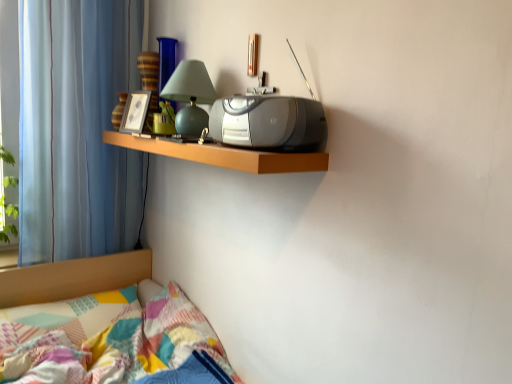
Question: In terms of size, does wooden shelf at upper center appear bigger or smaller than blue striped curtain at left?

Choices:
 (A) big
 (B) small

Answer: (B)

Question: Relative to blue striped curtain at left, is wooden shelf at upper center in front or behind?

Choices:
 (A) front
 (B) behind

Answer: (A)

Question: Based on their relative distances, which object is farther from the matte green glass table lamp at upper center?

Choices:
 (A) patchwork fabric bed at lower left
 (B) blue striped curtain at left
 (C) satin silver stereo at center
 (D) wooden shelf at upper center

Answer: (A)

Question: Estimate the real-world distances between objects in this image. Which object is farther from the matte green glass table lamp at upper center?

Choices:
 (A) patchwork fabric bed at lower left
 (B) satin silver stereo at center
 (C) wooden shelf at upper center
 (D) blue striped curtain at left

Answer: (A)